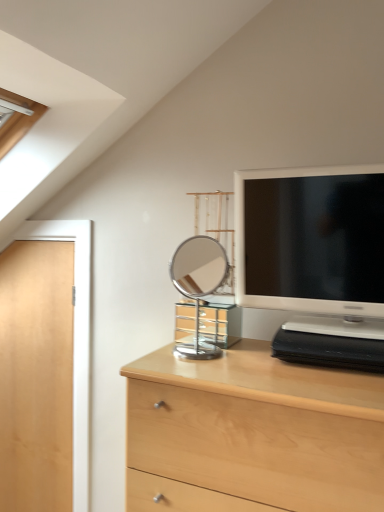
Find the location of a particular element. This screenshot has height=512, width=384. free spot above light wood door at left (from a real-world perspective) is located at coordinates (47, 217).